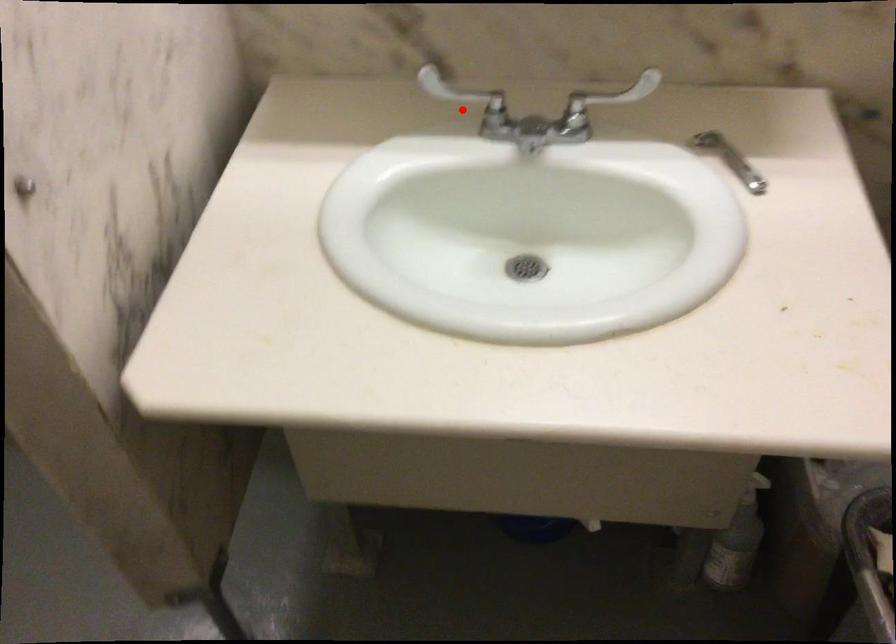
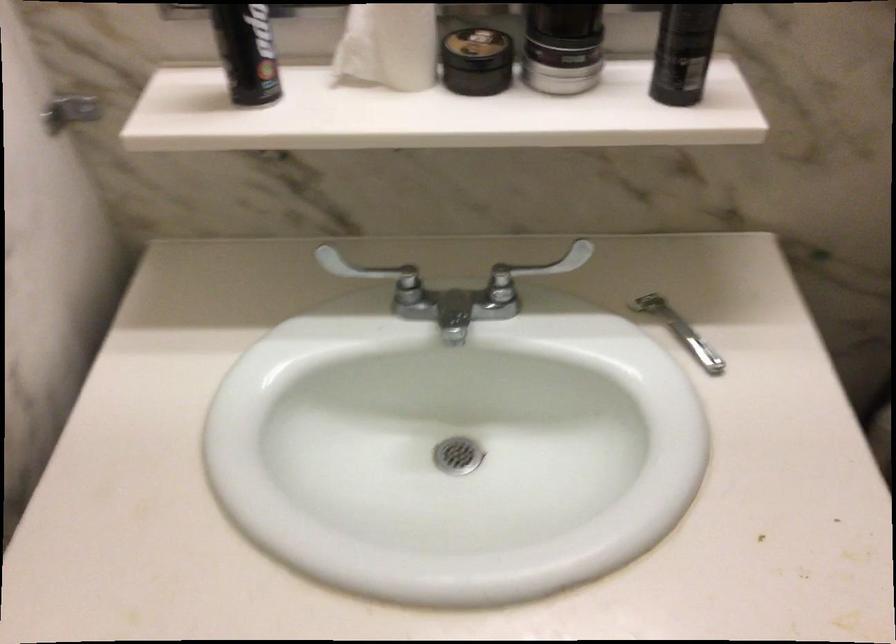
Question: I am providing you with two images of the same scene from different viewpoints. A red point is shown in image1. For the corresponding object point in image2, is it positioned nearer or farther from the camera?

Choices:
 (A) Nearer
 (B) Farther

Answer: (A)